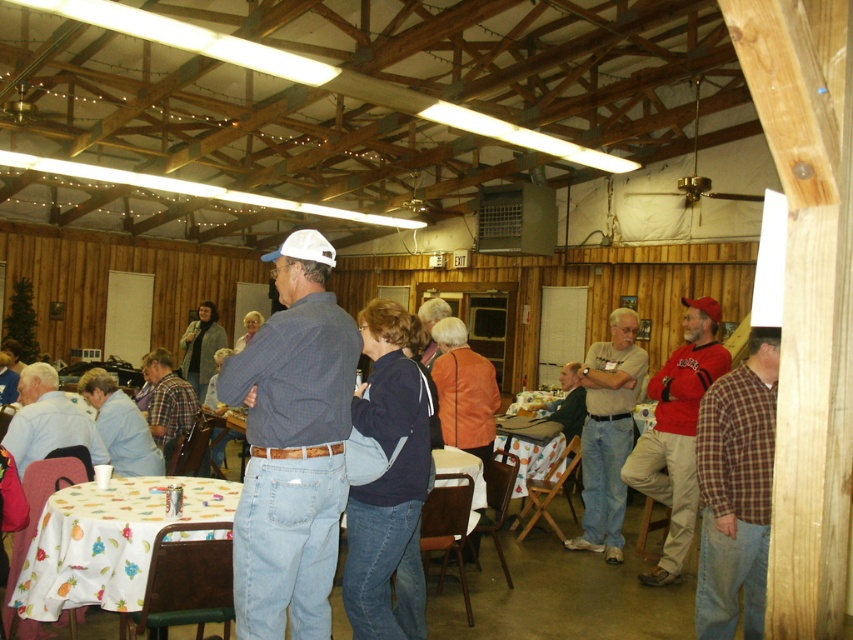
Question: Which object appears farthest from the camera in this image?

Choices:
 (A) white fabric table at lower left
 (B) dark blue plaid shirt at center

Answer: (A)

Question: Does white fabric table at lower left have a lesser width compared to denim jeans at center?

Choices:
 (A) yes
 (B) no

Answer: (B)

Question: Which object is farther from the camera taking this photo?

Choices:
 (A) light brown shirt at center
 (B) plaid shirt at center

Answer: (B)

Question: Can you confirm if light brown shirt at center is wider than plaid shirt at center?

Choices:
 (A) yes
 (B) no

Answer: (B)

Question: Which point is farther from the camera taking this photo?

Choices:
 (A) (161, 358)
 (B) (294, 433)

Answer: (A)

Question: Can you confirm if white fabric table at lower left is thinner than light blue shirt at lower left?

Choices:
 (A) yes
 (B) no

Answer: (B)